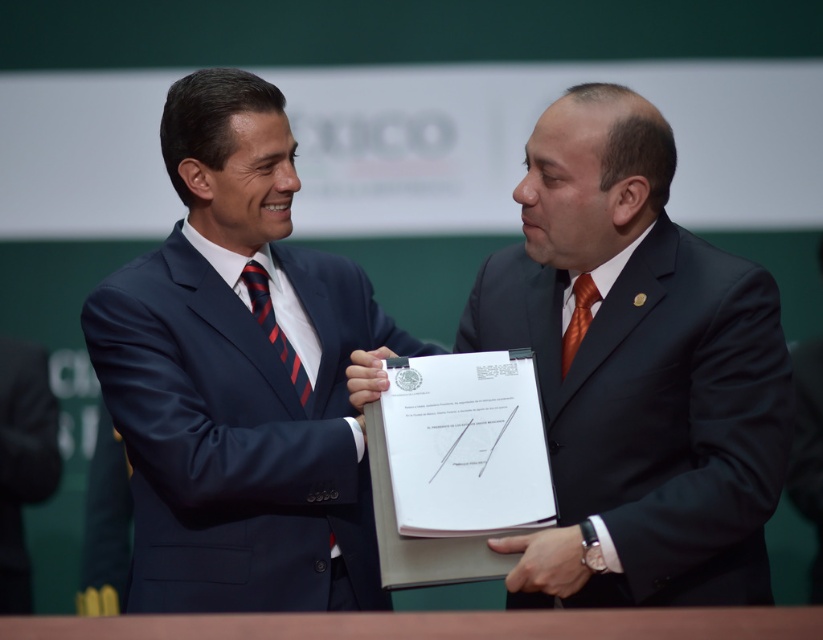
This screenshot has height=640, width=823. What do you see at coordinates (456, 465) in the screenshot?
I see `white paper clipboard at center` at bounding box center [456, 465].

Does white paper clipboard at center have a lesser height compared to orange silk tie at center?

No.

You are a GUI agent. You are given a task and a screenshot of the screen. Output one action in this format:
    pyautogui.click(x=<x>, y=<y>)
    Task: Click on the white paper clipboard at center
    
    Given the screenshot: What is the action you would take?
    pyautogui.click(x=456, y=465)

Which is more to the left, matte black suit at center or striped silk tie at center?

striped silk tie at center is more to the left.

Is matte black suit at center thinner than striped silk tie at center?

In fact, matte black suit at center might be wider than striped silk tie at center.

Is point (624, 464) positioned before point (295, 376)?

Yes, point (624, 464) is closer to viewer.

This screenshot has width=823, height=640. I want to click on matte black suit at center, so (640, 364).

Can you confirm if white paper at center is positioned below matte black hand at center?

Yes.

Does point (509, 573) come in front of point (380, 355)?

Yes, point (509, 573) is in front of point (380, 355).

This screenshot has width=823, height=640. In order to click on white paper at center in this screenshot , I will do `click(545, 561)`.